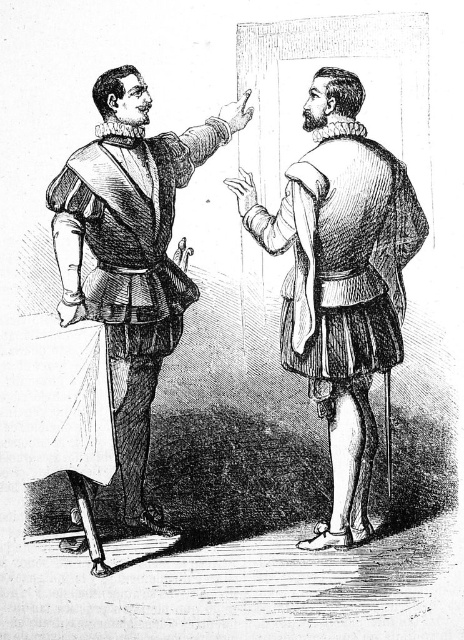
What do you see at coordinates (341, 280) in the screenshot? The image size is (464, 640). I see `etched paper robe at center` at bounding box center [341, 280].

Who is more distant from viewer, (376, 164) or (126, 445)?

The point (126, 445) is behind.

Where is `etched paper robe at center`? The height and width of the screenshot is (640, 464). etched paper robe at center is located at coordinates (341, 280).